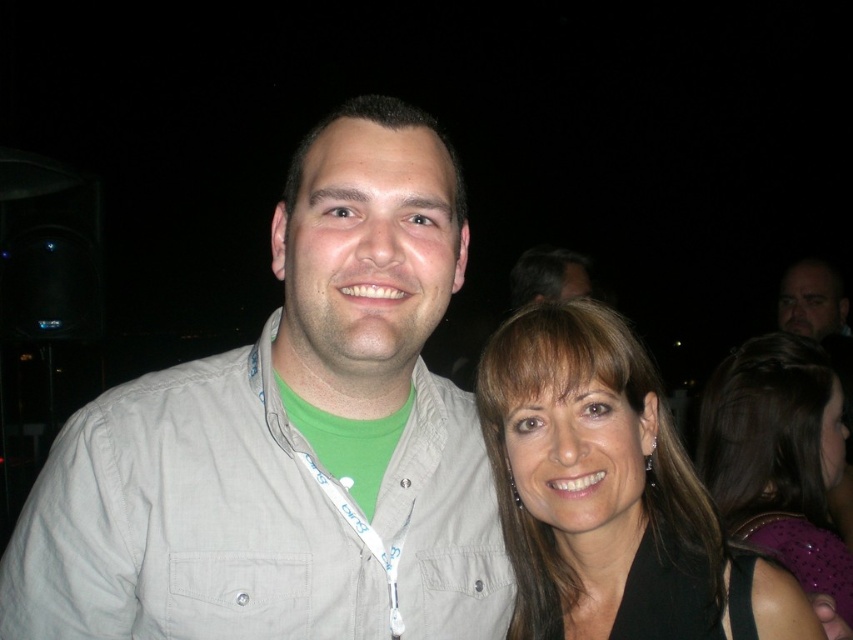
You are a photographer who needs to adjust the lighting between the light gray shirt at center and the black fabric hair at upper right. Since they are 28.10 inches apart, what is the minimum distance you should set your camera flash to ensure both are properly lit?

The minimum distance should be at least 28.10 inches to cover both the light gray shirt at center and the black fabric hair at upper right.

Looking at this image, you are a photographer reviewing this image. You notice two hair strands in the scene. The smooth brown hair at center and the dark brown hair at upper center. Which hair strand is closer to the camera?

The smooth brown hair at center is closer to the camera because it is in front of the dark brown hair at upper center.